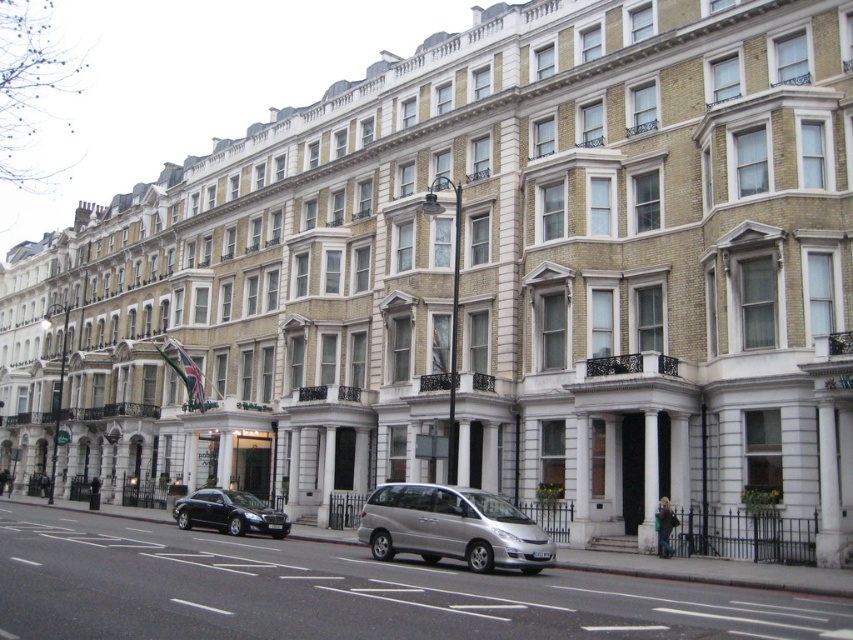
You are a tourist standing on the sidewalk in front of the buildings. You see the silver metallic van at center and the shiny black sedan at lower left. Which vehicle is positioned farther to the right?

The silver metallic van at center is positioned to the right of the shiny black sedan at lower left, so it is farther to the right.

You are a delivery driver who needs to unload a package from your truck. You are parked between the silver metallic van at center and the silver metallic minivan at center. The loading dock is 8 meters away from your truck. Can you safely back up your truck to reach the loading dock without hitting either vehicle?

The distance between the silver metallic van at center and the silver metallic minivan at center is 7.52 meters. Since the loading dock is 8 meters away, you have enough space to back up your truck without hitting either vehicle.

You are a delivery driver who needs to park your vehicle in one of the two available spots in front of the buildings. Your vehicle is 4 meters long. The parking spots are 4.5 meters long. Which vehicle among the silver metallic minivan at center and the shiny black sedan at lower left would require less space to park?

The silver metallic minivan at center is smaller than the shiny black sedan at lower left. Since the parking spots are 4.5 meters long and your vehicle is 4 meters long, the silver metallic minivan at center would require less space compared to the shiny black sedan at lower left, making it a better fit for the parking spot.